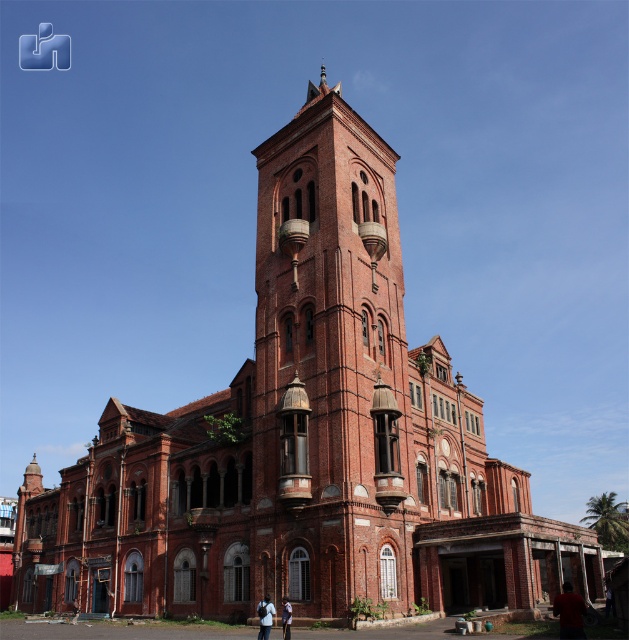
You are standing in front of the historic building and notice two points marked on the tower. The first point is at coordinates point (569, 608) and the second is at point (260, 611). Which point is closer to you as you face the building?

Point (569, 608) is in front of point (260, 611), so it is closer to you as you face the building.

Consider the image. You are standing in front of the historic building and notice two items near the base of the structure. The items are a matte red shirt at lower right and a dark blue fabric at lower center. Which item is positioned higher relative to the other?

The matte red shirt at lower right is above the dark blue fabric at lower center, so it is positioned higher.